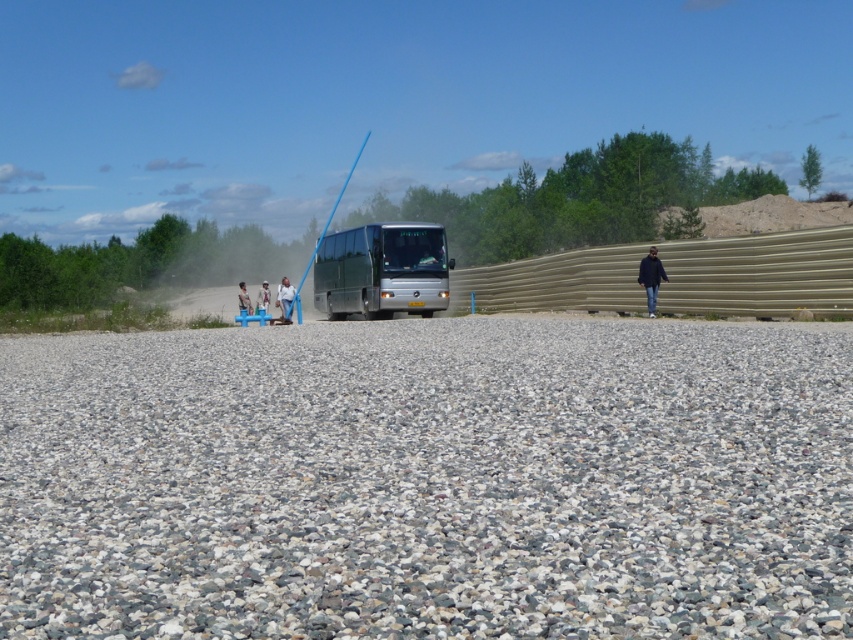
Is point (756, 480) closer to viewer compared to point (262, 285)?

That is True.

Does gray gravel at center lie in front of camouflage fabric shirt at center?

Yes, it is in front of camouflage fabric shirt at center.

I want to click on gray gravel at center, so click(428, 481).

I want to click on gray gravel at center, so click(428, 481).

Does silver metallic bus at center have a lesser width compared to light brown leather jacket at center?

Yes.

Is point (390, 314) closer to viewer compared to point (241, 289)?

Yes, point (390, 314) is in front of point (241, 289).

The image size is (853, 640). In order to click on silver metallic bus at center in this screenshot , I will do `click(381, 269)`.

Is gray gravel at center to the right of light brown leather jacket at center from the viewer's perspective?

Correct, you'll find gray gravel at center to the right of light brown leather jacket at center.

Locate an element on the screen. gray gravel at center is located at coordinates (428, 481).

Is point (361, 344) positioned before point (247, 307)?

That is True.

At what (x,y) coordinates should I click in order to perform the action: click on gray gravel at center. Please return your answer as a coordinate pair (x, y). Looking at the image, I should click on (428, 481).